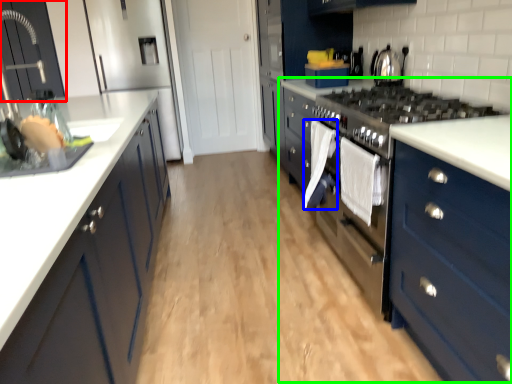
Question: Which object is positioned closest to cabinetry (highlighted by a red box)? Select from clothe (highlighted by a blue box) and dresser (highlighted by a green box).

Choices:
 (A) clothe
 (B) dresser

Answer: (A)